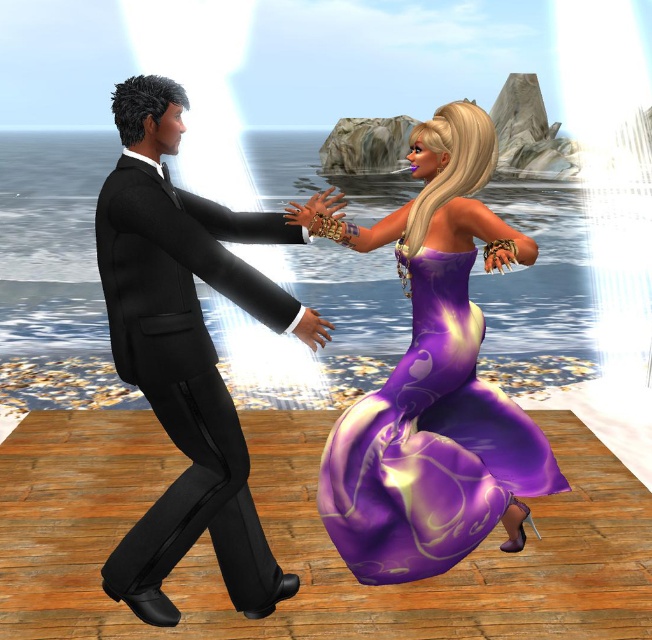
You are a photographer positioned at point (185, 355). You want to capture a photo of the matte black suit at left and the flowing purple dress at right. Which character should you focus on first to ensure they are in the frame?

The point (185, 355) corresponds to the matte black suit at left, so you should focus on the matte black suit at left first as you are positioned directly at their location.

You are a costume designer preparing for a dance performance. You need to ensure that the matte black suit at left and the purple satin dress at center can be worn by performers without overlapping. Given that the stage has limited space between them, which costume has a wider silhouette?

The purple satin dress at center has a wider silhouette than the matte black suit at left since its width is greater, so it requires more space between the performers.

Based on the photo, you are standing at the point marked as point (x=141, y=330) in the image. The stage has a safety distance rule that requires all dancers to stay at least 3 meters away from the edge of the stage. Can you determine if you are within the safe area?

The distance between point (x=141, y=330) and the viewer is 2.81 meters. Since the safety rule requires staying at least 3 meters away from the edge, you are currently 2.81 meters away, which is less than the required 3 meters. Therefore, you are not within the safe area.